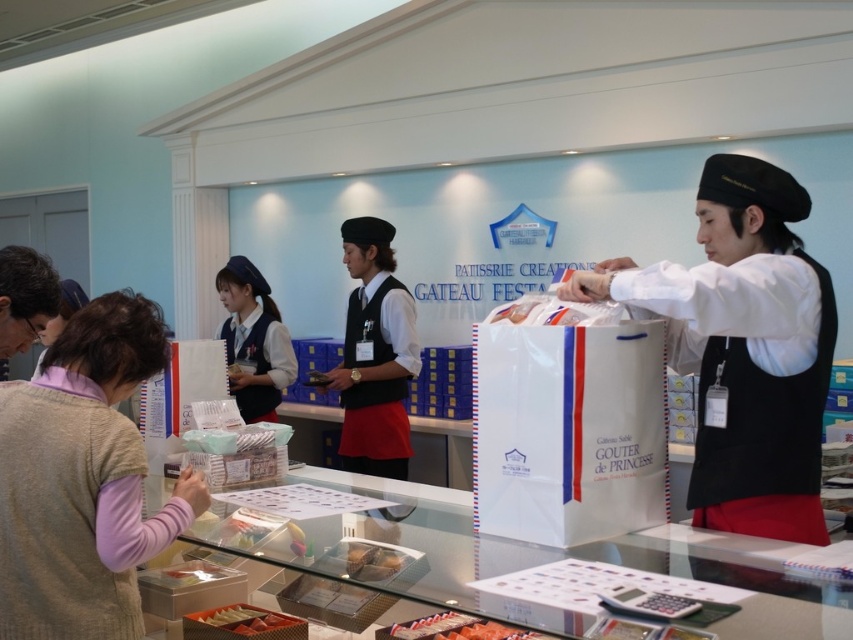
Between point (21, 413) and point (360, 552), which one is positioned behind?

The point (360, 552) is behind.

Where is `knitted beige vest at lower left`? This screenshot has height=640, width=853. knitted beige vest at lower left is located at coordinates (82, 481).

Is point (137, 563) farther from camera compared to point (358, 547)?

No, (137, 563) is closer to viewer.

Where is `knitted beige vest at lower left`? This screenshot has height=640, width=853. knitted beige vest at lower left is located at coordinates (82, 481).

Does matte white uniform at center have a lesser width compared to matte brown chocolate bar at center?

Incorrect, matte white uniform at center's width is not less than matte brown chocolate bar at center's.

Does matte white uniform at center have a smaller size compared to matte brown chocolate bar at center?

No.

Does point (277, 332) come closer to viewer compared to point (364, 544)?

No.

At what (x,y) coordinates should I click in order to perform the action: click on matte white uniform at center. Please return your answer as a coordinate pair (x, y). Looking at the image, I should click on (253, 340).

Is knitted beige vest at lower left thinner than matte white uniform at center?

Correct, knitted beige vest at lower left's width is less than matte white uniform at center's.

The image size is (853, 640). Describe the element at coordinates (82, 481) in the screenshot. I see `knitted beige vest at lower left` at that location.

Find the location of a particular element. This screenshot has height=640, width=853. knitted beige vest at lower left is located at coordinates (82, 481).